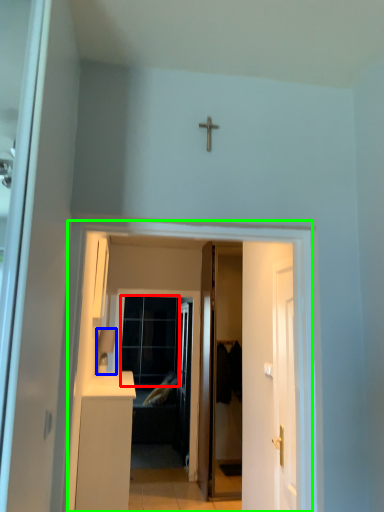
Question: Estimate the real-world distances between objects in this image. Which object is farther from glass door (highlighted by a red box), lamp (highlighted by a blue box) or corridor (highlighted by a green box)?

Choices:
 (A) lamp
 (B) corridor

Answer: (B)